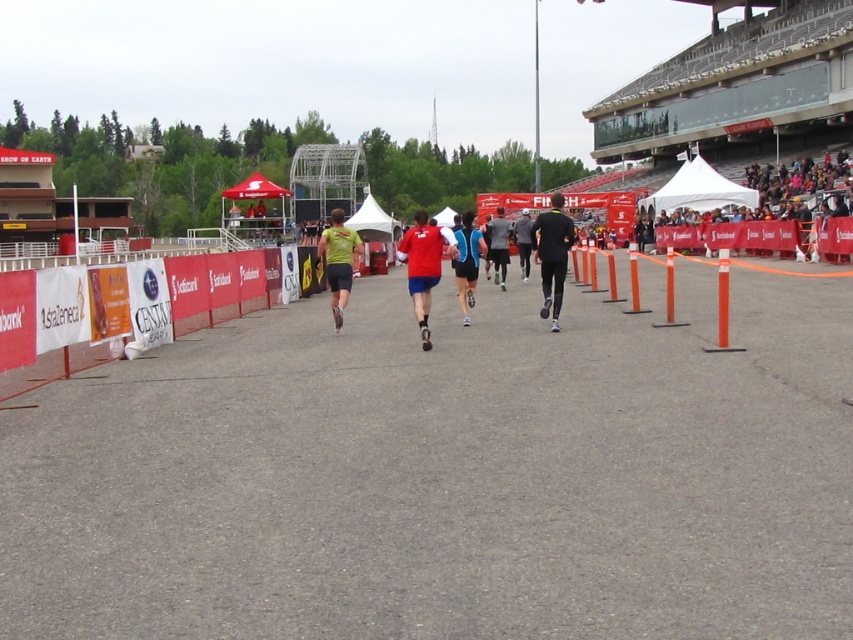
Question: Can you confirm if blue fabric at center is positioned below matte black shorts at center?

Choices:
 (A) no
 (B) yes

Answer: (B)

Question: Which point is closer to the camera taking this photo?

Choices:
 (A) (173, 396)
 (B) (477, 237)
 (C) (495, 236)

Answer: (A)

Question: Considering the relative positions of gray asphalt race track at center and matte black shorts at center in the image provided, where is gray asphalt race track at center located with respect to matte black shorts at center?

Choices:
 (A) right
 (B) left

Answer: (B)

Question: Which of the following is the closest to the observer?

Choices:
 (A) (553, 240)
 (B) (479, 236)
 (C) (432, 244)
 (D) (332, 252)

Answer: (C)

Question: Does black matte running suit at center appear on the left side of matte black shorts at center?

Choices:
 (A) yes
 (B) no

Answer: (B)

Question: Which of these objects is positioned closest to the black matte running suit at center?

Choices:
 (A) gray asphalt race track at center
 (B) matte green shirt at center
 (C) matte black shorts at center
 (D) matte red shirt at center

Answer: (C)